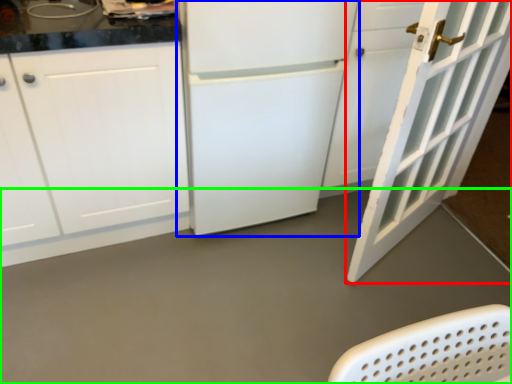
Question: Estimate the real-world distances between objects in this image. Which object is farther from door (highlighted by a red box), refrigerator (highlighted by a blue box) or concrete (highlighted by a green box)?

Choices:
 (A) refrigerator
 (B) concrete

Answer: (B)